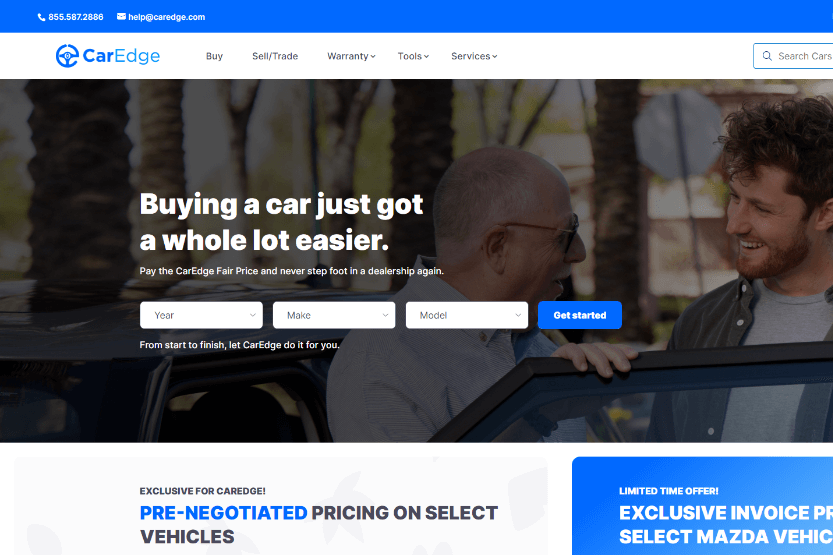
At what (x,y) coordinates should I click in order to perform the action: click on window. Please return your answer as a coordinate pair (x, y). Image resolution: width=833 pixels, height=555 pixels. Looking at the image, I should click on (636, 403).